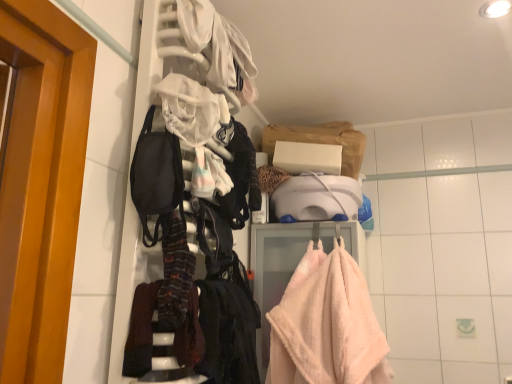
Question: Does black fabric at center have a greater height compared to black fabric mask at left?

Choices:
 (A) no
 (B) yes

Answer: (B)

Question: Can you confirm if black fabric at center is bigger than black fabric mask at left?

Choices:
 (A) no
 (B) yes

Answer: (B)

Question: Does black fabric at center appear on the left side of black fabric mask at left?

Choices:
 (A) yes
 (B) no

Answer: (B)

Question: Can we say black fabric at center lies outside black fabric mask at left?

Choices:
 (A) yes
 (B) no

Answer: (A)

Question: Could you tell me if black fabric at center is facing black fabric mask at left?

Choices:
 (A) yes
 (B) no

Answer: (B)

Question: Considering the positions of black fabric at center and black fabric mask at left in the image, is black fabric at center bigger or smaller than black fabric mask at left?

Choices:
 (A) big
 (B) small

Answer: (A)

Question: Is black fabric at center in front of or behind black fabric mask at left in the image?

Choices:
 (A) behind
 (B) front

Answer: (A)

Question: Is black fabric at center taller or shorter than black fabric mask at left?

Choices:
 (A) short
 (B) tall

Answer: (B)

Question: Is black fabric at center spatially inside black fabric mask at left, or outside of it?

Choices:
 (A) outside
 (B) inside

Answer: (A)

Question: Considering the positions of black fabric at center and soft pink plush towel at center in the image, is black fabric at center wider or thinner than soft pink plush towel at center?

Choices:
 (A) thin
 (B) wide

Answer: (A)

Question: In the image, is black fabric at center positioned in front of or behind soft pink plush towel at center?

Choices:
 (A) front
 (B) behind

Answer: (A)

Question: Do you think black fabric at center is within soft pink plush towel at center, or outside of it?

Choices:
 (A) outside
 (B) inside

Answer: (A)

Question: Based on their sizes in the image, would you say black fabric at center is bigger or smaller than soft pink plush towel at center?

Choices:
 (A) small
 (B) big

Answer: (A)

Question: Considering the positions of soft pink plush towel at center and black fabric at center in the image, is soft pink plush towel at center wider or thinner than black fabric at center?

Choices:
 (A) thin
 (B) wide

Answer: (B)

Question: From a real-world perspective, is soft pink plush towel at center positioned above or below black fabric at center?

Choices:
 (A) below
 (B) above

Answer: (B)